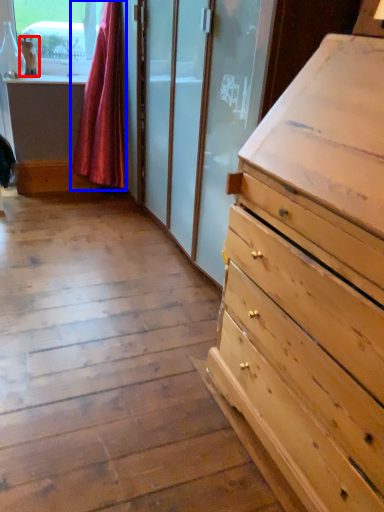
Question: Which object appears farthest to the camera in this image, animal (highlighted by a red box) or curtain (highlighted by a blue box)?

Choices:
 (A) animal
 (B) curtain

Answer: (A)